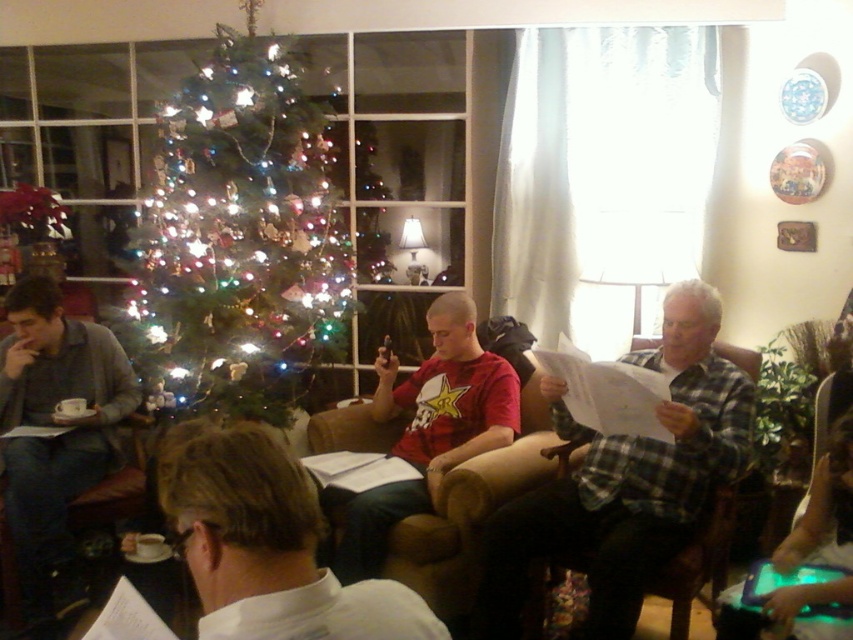
Which of these two, iridescent glass christmas tree at center or plaid flannel shirt at center, stands shorter?

plaid flannel shirt at center

Which is behind, point (192, 352) or point (740, 378)?

Point (192, 352)

Between point (309, 144) and point (608, 540), which one is positioned behind?

The point (309, 144) is behind.

At what (x,y) coordinates should I click in order to perform the action: click on iridescent glass christmas tree at center. Please return your answer as a coordinate pair (x, y). This screenshot has width=853, height=640. Looking at the image, I should click on (242, 234).

Is white paper at center below red matte shirt at center?

No, white paper at center is not below red matte shirt at center.

Which is above, white paper at center or red matte shirt at center?

white paper at center is higher up.

Based on the photo, who is more forward, (242, 442) or (374, 490)?

Point (242, 442) is more forward.

The image size is (853, 640). I want to click on white paper at center, so click(x=267, y=545).

Based on the photo, who is positioned more to the left, iridescent glass christmas tree at center or gray sweater at left?

Positioned to the left is gray sweater at left.

Consider the image. Can you confirm if iridescent glass christmas tree at center is thinner than gray sweater at left?

No.

The height and width of the screenshot is (640, 853). I want to click on iridescent glass christmas tree at center, so click(x=242, y=234).